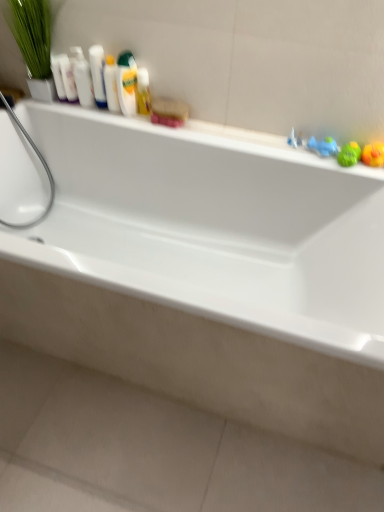
Locate an element on the screen. empty space that is ontop of white glossy ledge at upper center (from a real-world perspective) is located at coordinates (249, 131).